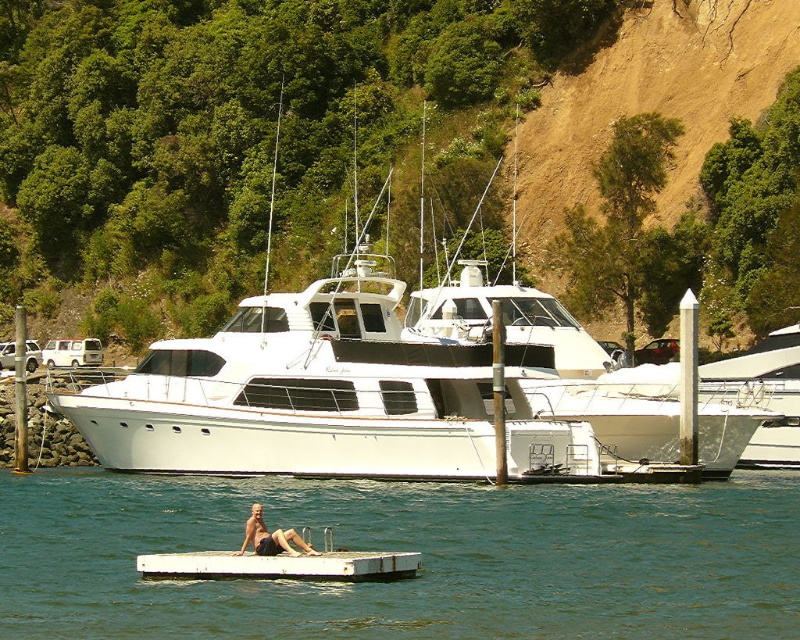
Which is more to the right, green leafy hillside at upper center or smooth tan skin at lower center?

smooth tan skin at lower center is more to the right.

Based on the photo, who is more distant from viewer, (674,259) or (297,541)?

Point (674,259)

Where is `green leafy hillside at upper center`? This screenshot has height=640, width=800. green leafy hillside at upper center is located at coordinates (397, 150).

From the picture: Can you confirm if green leafy hillside at upper center is smaller than clear blue water at center?

Actually, green leafy hillside at upper center might be larger than clear blue water at center.

Between green leafy hillside at upper center and clear blue water at center, which one has more height?

green leafy hillside at upper center

This screenshot has width=800, height=640. Describe the element at coordinates (397, 150) in the screenshot. I see `green leafy hillside at upper center` at that location.

Where is `green leafy hillside at upper center`? green leafy hillside at upper center is located at coordinates (397, 150).

Does clear blue water at center appear under smooth tan skin at lower center?

Yes, clear blue water at center is below smooth tan skin at lower center.

Between point (114, 572) and point (256, 509), which one is positioned in front?

Point (256, 509) is more forward.

Which is in front, point (748, 560) or point (276, 531)?

Point (276, 531)

This screenshot has height=640, width=800. I want to click on clear blue water at center, so [408, 548].